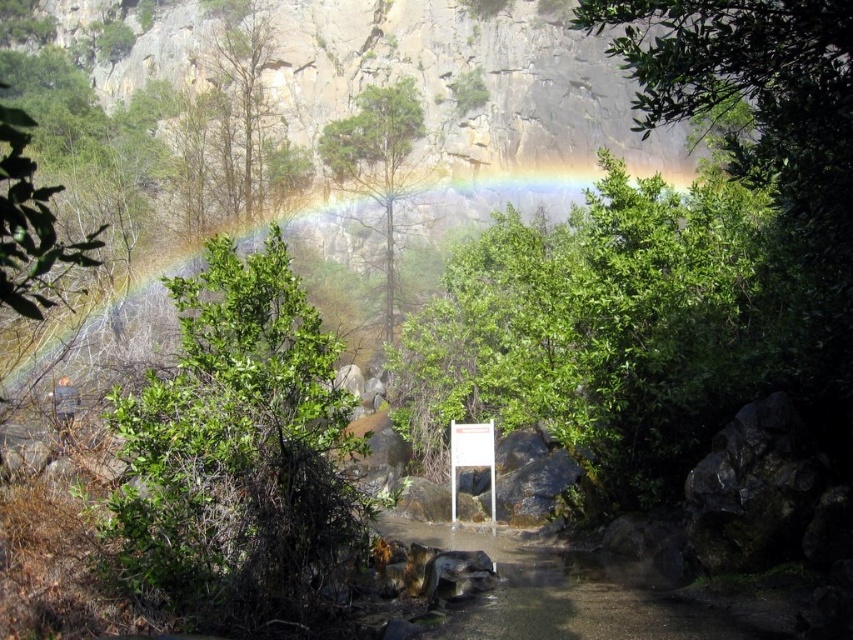
You are an artist sketching the scene and want to ensure the green leafy bush at left and the rainbow at upper center are proportionally accurate. Which object should you draw smaller in your sketch?

The green leafy bush at left should be drawn smaller than the rainbow at upper center because it occupies less space in the scene.

You are an environmental scientist assessing the vegetation in this area. You need to determine which plant is shorter between the green leafy bush at left and the green matte tree at center. Which one should you classify as shorter?

The green leafy bush at left has a lesser height compared to the green matte tree at center, so the green leafy bush at left is shorter.